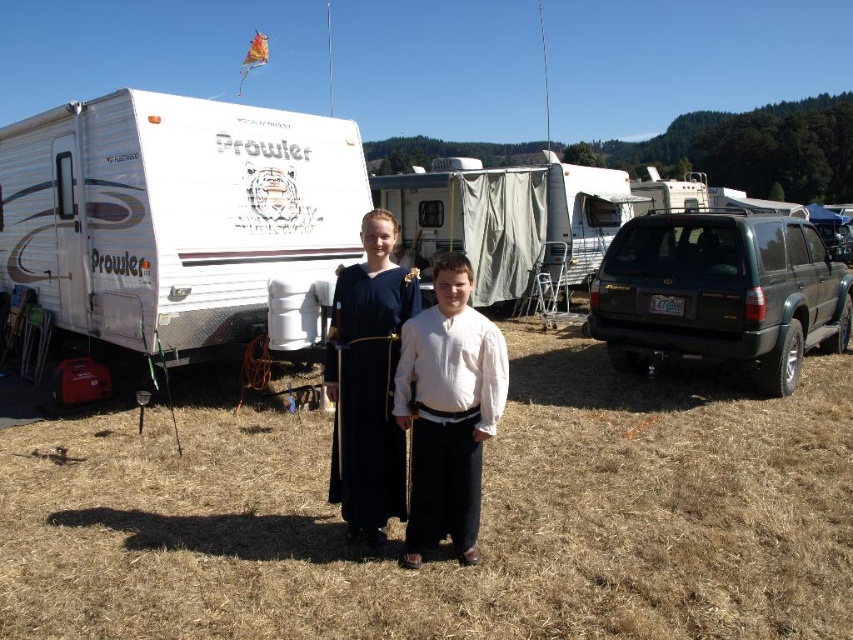
Question: Which of the following is the farthest from the observer?

Choices:
 (A) white glossy camper at left
 (B) matte black dress at center
 (C) dark blue fabric dress at center
 (D) dark green plastic suv at right

Answer: (D)

Question: Does brown grass at center have a smaller size compared to white glossy camper at left?

Choices:
 (A) yes
 (B) no

Answer: (A)

Question: Does dark green plastic suv at right have a lesser width compared to dark blue fabric dress at center?

Choices:
 (A) no
 (B) yes

Answer: (A)

Question: Estimate the real-world distances between objects in this image. Which object is farther from the brown grass at center?

Choices:
 (A) matte black dress at center
 (B) white glossy camper at left

Answer: (B)

Question: Which object is the farthest from the dark green plastic suv at right?

Choices:
 (A) matte black dress at center
 (B) dark blue fabric dress at center
 (C) brown grass at center
 (D) white glossy camper at left

Answer: (B)

Question: Is matte black dress at center wider than dark blue fabric dress at center?

Choices:
 (A) yes
 (B) no

Answer: (A)